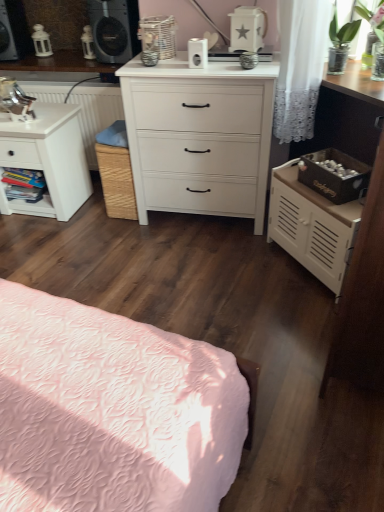
Question: Should I look upward or downward to see white matte chest of drawers at center?

Choices:
 (A) down
 (B) up

Answer: (B)

Question: Is white matte chest of drawers at center to the right of wooden bookshelf at left from the viewer's perspective?

Choices:
 (A) no
 (B) yes

Answer: (B)

Question: Does white matte chest of drawers at center have a larger size compared to wooden bookshelf at left?

Choices:
 (A) yes
 (B) no

Answer: (A)

Question: Does white matte chest of drawers at center have a greater height compared to wooden bookshelf at left?

Choices:
 (A) yes
 (B) no

Answer: (A)

Question: From the image's perspective, is white matte chest of drawers at center above wooden bookshelf at left?

Choices:
 (A) yes
 (B) no

Answer: (A)

Question: Is white matte chest of drawers at center outside of wooden bookshelf at left?

Choices:
 (A) no
 (B) yes

Answer: (B)

Question: From a real-world perspective, does white matte chest of drawers at center sit lower than wooden bookshelf at left?

Choices:
 (A) no
 (B) yes

Answer: (A)

Question: From the image's perspective, is matte black speaker at upper left, the 1th speaker from the left, above white matte nightstand at left, the 1th nightstand in the left-to-right sequence?

Choices:
 (A) no
 (B) yes

Answer: (B)

Question: Are matte black speaker at upper left, the 1th speaker from the left, and white matte nightstand at left, the 1th nightstand in the left-to-right sequence, located far from each other?

Choices:
 (A) yes
 (B) no

Answer: (B)

Question: Is matte black speaker at upper left, the 1th speaker from the left, positioned behind white matte nightstand at left, the 1th nightstand in the left-to-right sequence?

Choices:
 (A) yes
 (B) no

Answer: (A)

Question: Can you confirm if matte black speaker at upper left, which is the 2th speaker from right to left, is taller than white matte nightstand at left, the 1th nightstand in the left-to-right sequence?

Choices:
 (A) no
 (B) yes

Answer: (A)

Question: Are matte black speaker at upper left, the 1th speaker from the left, and white matte nightstand at left, the 2th nightstand positioned from the right, beside each other?

Choices:
 (A) yes
 (B) no

Answer: (B)

Question: From a real-world perspective, is matte black speaker at upper left, the 1th speaker from the left, located beneath white matte nightstand at left, the 1th nightstand in the left-to-right sequence?

Choices:
 (A) no
 (B) yes

Answer: (A)